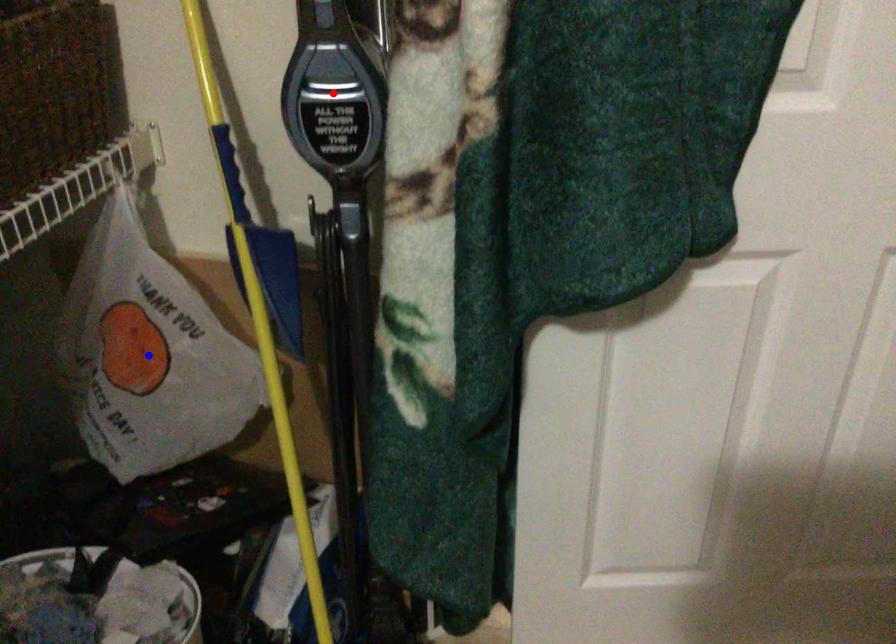
Question: In the image, two points are highlighted. Which point is nearer to the camera? Reply with the corresponding letter.

Choices:
 (A) blue point
 (B) red point

Answer: (B)